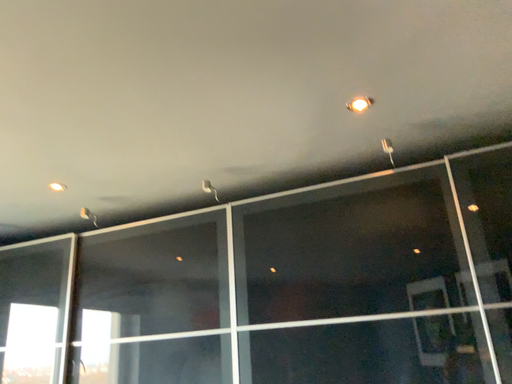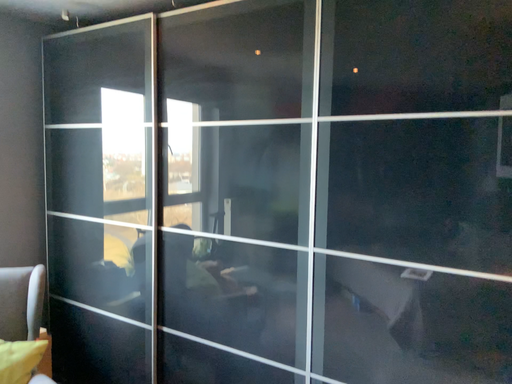
Question: How did the camera likely rotate when shooting the video?

Choices:
 (A) rotated right
 (B) rotated left

Answer: (B)